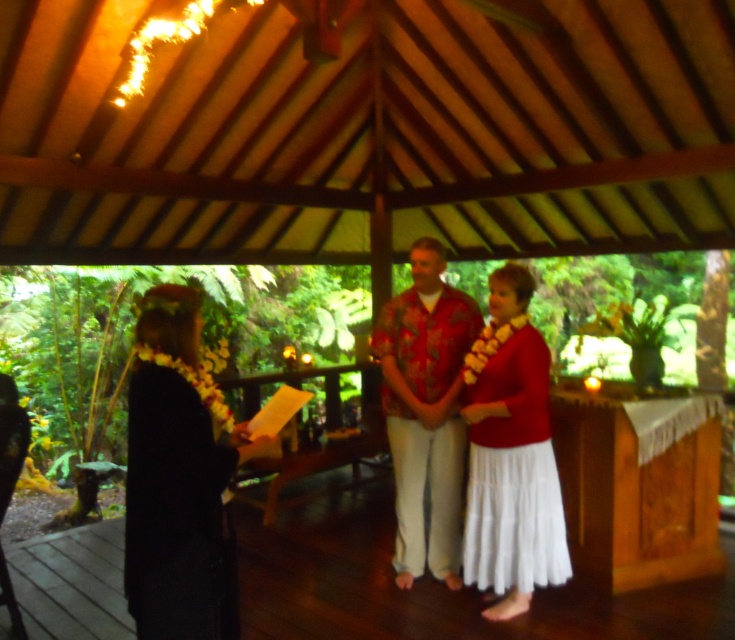
Question: Is black fabric dress at left smaller than hawaiian print shirt at center?

Choices:
 (A) yes
 (B) no

Answer: (A)

Question: Which is farther from the white cotton skirt at center?

Choices:
 (A) black fabric dress at left
 (B) hawaiian print shirt at center

Answer: (A)

Question: Can you confirm if black fabric dress at left is positioned to the left of hawaiian print shirt at center?

Choices:
 (A) no
 (B) yes

Answer: (B)

Question: Which object is farther from the camera taking this photo?

Choices:
 (A) black fabric dress at left
 (B) hawaiian print shirt at center
 (C) white cotton skirt at center

Answer: (B)

Question: Estimate the real-world distances between objects in this image. Which object is farther from the black fabric dress at left?

Choices:
 (A) white cotton skirt at center
 (B) hawaiian print shirt at center

Answer: (B)

Question: Does white cotton skirt at center come in front of hawaiian print shirt at center?

Choices:
 (A) no
 (B) yes

Answer: (B)